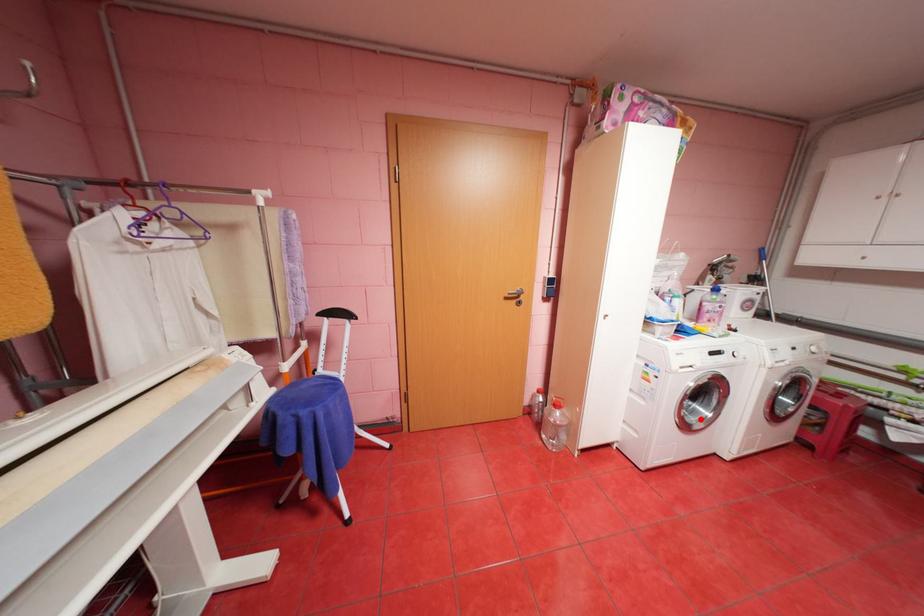
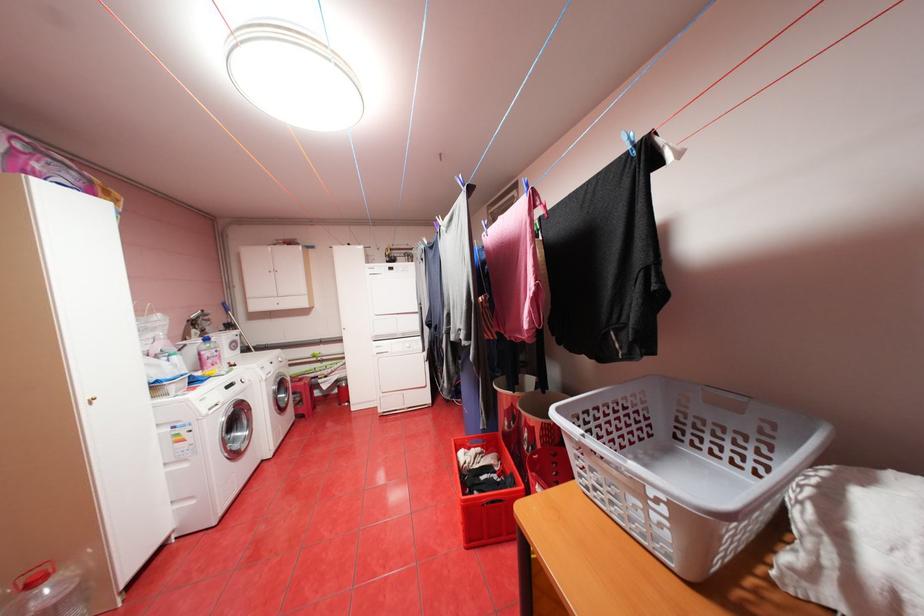
Question: A red point is marked in image1. In image2, is the corresponding 3D point closer to the camera or farther? Reply with the corresponding letter.

Choices:
 (A) The corresponding 3D point is closer.
 (B) The corresponding 3D point is farther.

Answer: (A)